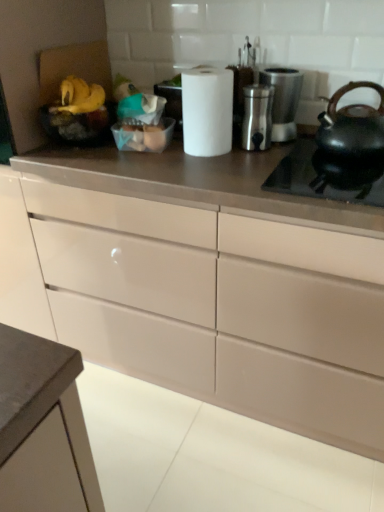
Question: Is matte black kettle at right situated inside matte white drawers at center or outside?

Choices:
 (A) inside
 (B) outside

Answer: (B)

Question: From their relative heights in the image, would you say matte black kettle at right is taller or shorter than matte white drawers at center?

Choices:
 (A) short
 (B) tall

Answer: (A)

Question: Based on their relative distances, which object is nearer to the matte black kettle at right?

Choices:
 (A) black matte gas stove at right
 (B) satin silver coffee maker at upper right, which is counted as the 2th appliance, starting from the left
 (C) matte white drawers at center
 (D) yellow matte bananas at upper left, which appears as the first food when viewed from the left
 (E) translucent plastic eggs at center, the first food viewed from the right

Answer: (A)

Question: Based on their relative distances, which object is farther from the satin silver container at center, which appears as the 2th appliance when viewed from the right?

Choices:
 (A) black matte gas stove at right
 (B) matte white drawers at center
 (C) translucent plastic eggs at center, the first food viewed from the right
 (D) yellow matte bananas at upper left, which appears as the first food when viewed from the left
 (E) satin silver coffee maker at upper right, the 1th appliance from the right

Answer: (B)